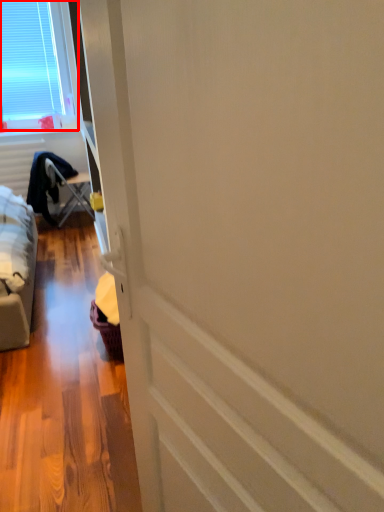
Question: From the image's perspective, what is the correct spatial positioning of window (annotated by the red box) in reference to furniture?

Choices:
 (A) below
 (B) above

Answer: (B)